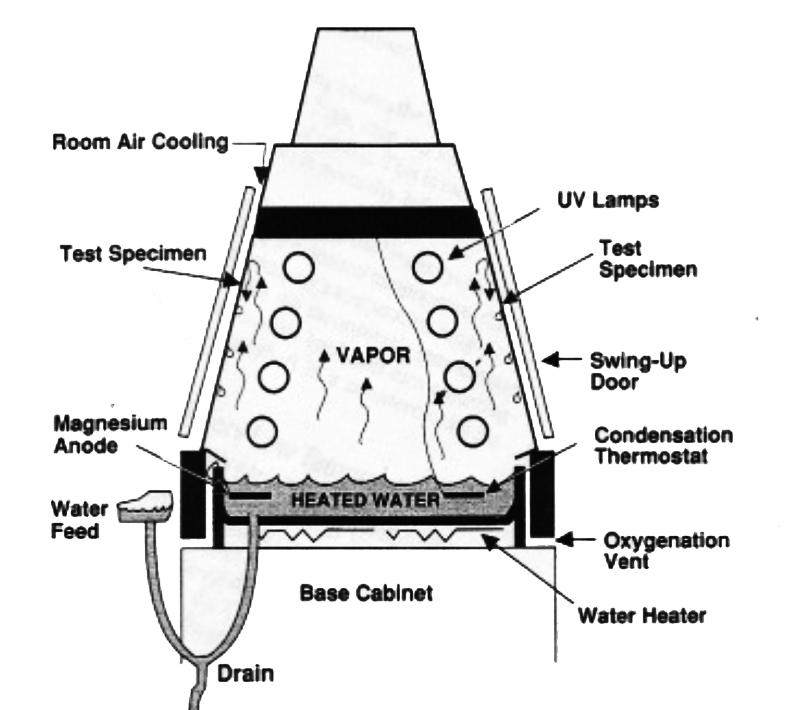
The image size is (789, 710). I want to click on water heater, so click(484, 525).